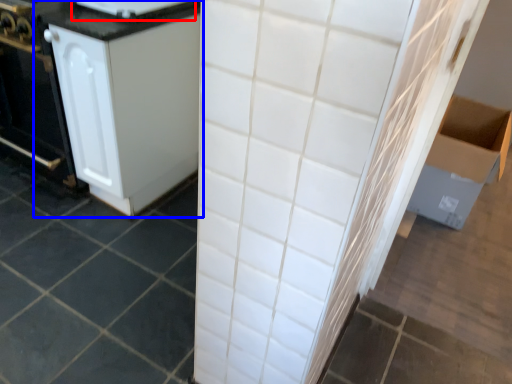
Question: Which object is further to the camera taking this photo, appliance (highlighted by a red box) or cabinetry (highlighted by a blue box)?

Choices:
 (A) appliance
 (B) cabinetry

Answer: (A)